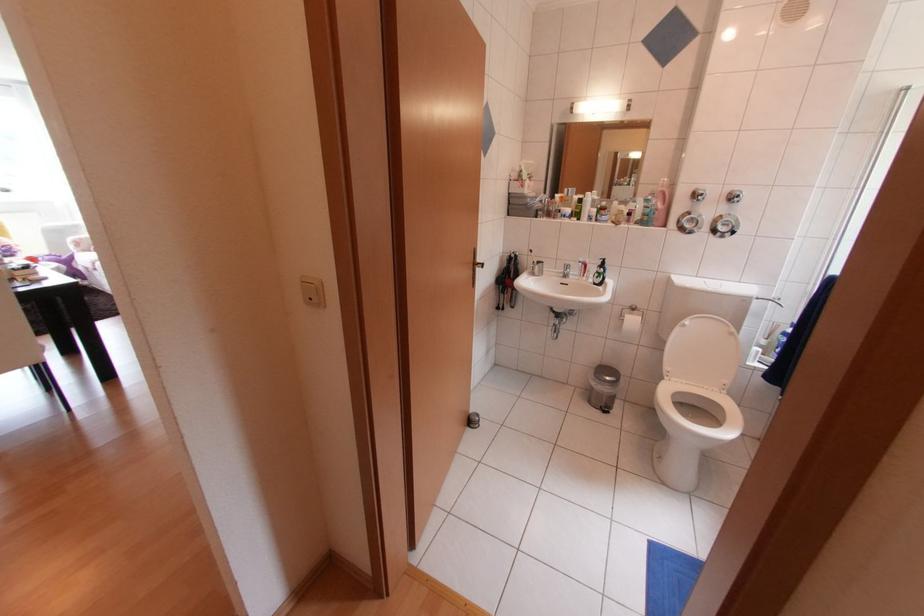
Where would you lift the faucet handle? Please return your answer as a coordinate pair (x, y).

(565, 262)